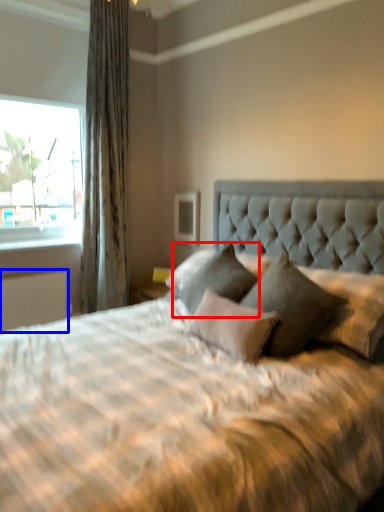
Question: Which object appears farthest to the camera in this image, pillow (highlighted by a red box) or radiator (highlighted by a blue box)?

Choices:
 (A) pillow
 (B) radiator

Answer: (B)